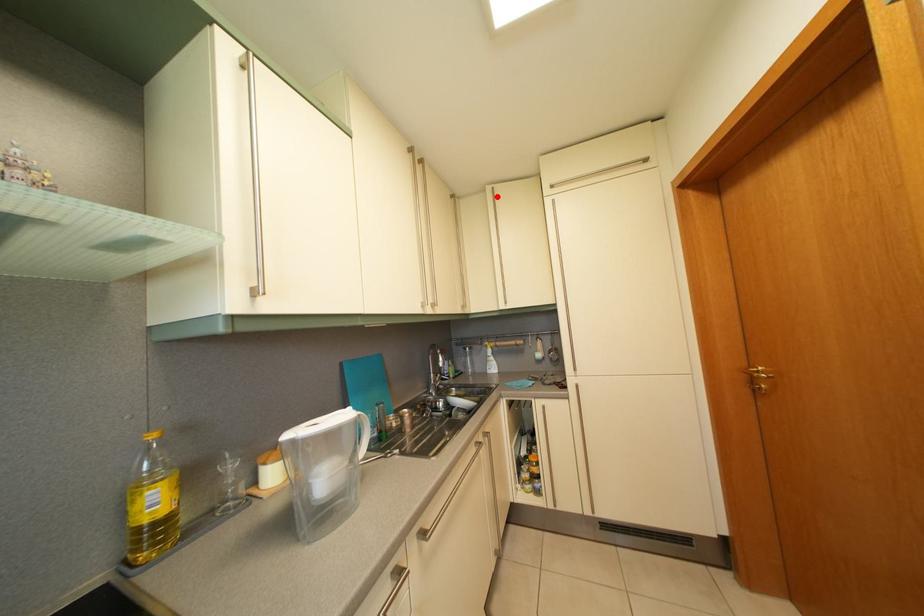
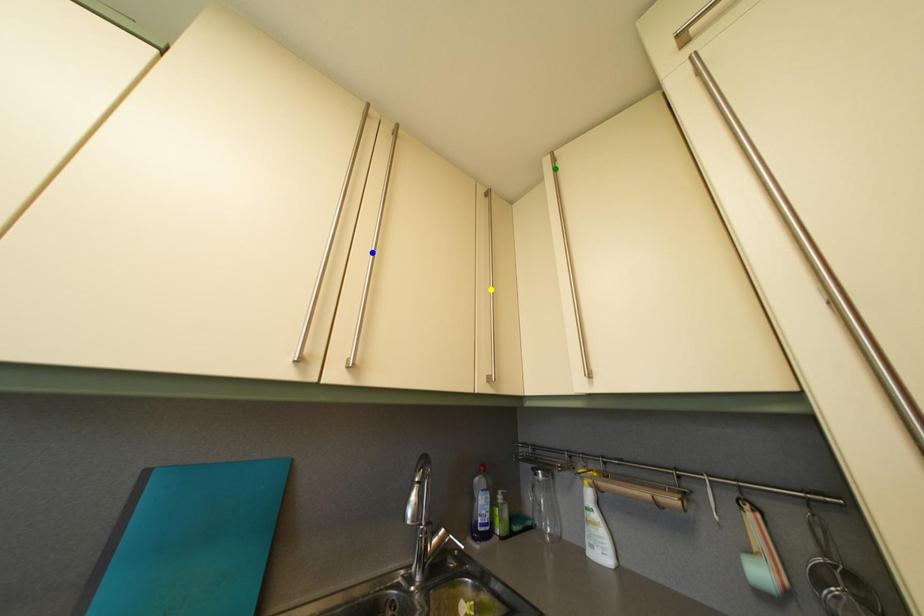
Question: I am providing you with two images of the same scene from different viewpoints. A red point is marked on the first image. You are given multiple points on the second image. Can you choose the point in image 2 that corresponds to the point in image 1?

Choices:
 (A) yellow point
 (B) blue point
 (C) green point

Answer: (C)